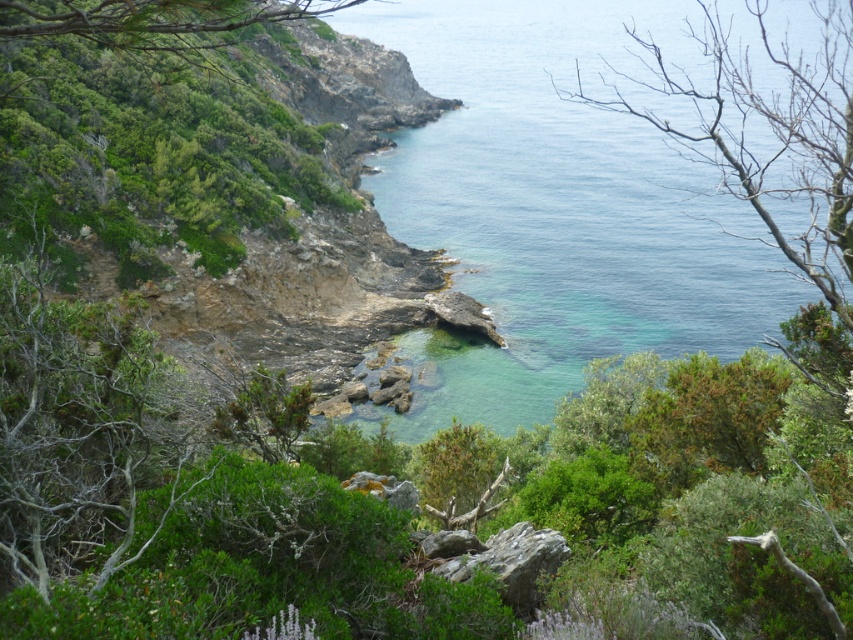
Question: Which point is farther to the camera?

Choices:
 (A) green leafy tree at upper left
 (B) clear blue water at center
 (C) rusty rock at center

Answer: (C)

Question: Does clear blue water at center appear under green leafy tree at upper left?

Choices:
 (A) no
 (B) yes

Answer: (A)

Question: Does bare branches at upper right lie in front of rusty rock at center?

Choices:
 (A) yes
 (B) no

Answer: (A)

Question: Which is nearer to the green leafy tree at upper left?

Choices:
 (A) clear blue water at center
 (B) bare branches at upper right
 (C) rusty rock at center

Answer: (C)

Question: Is bare branches at upper right smaller than green leafy tree at upper left?

Choices:
 (A) no
 (B) yes

Answer: (A)

Question: Which point is farther to the camera?

Choices:
 (A) (492, 547)
 (B) (102, 13)
 (C) (732, 324)
 (D) (828, 74)

Answer: (D)